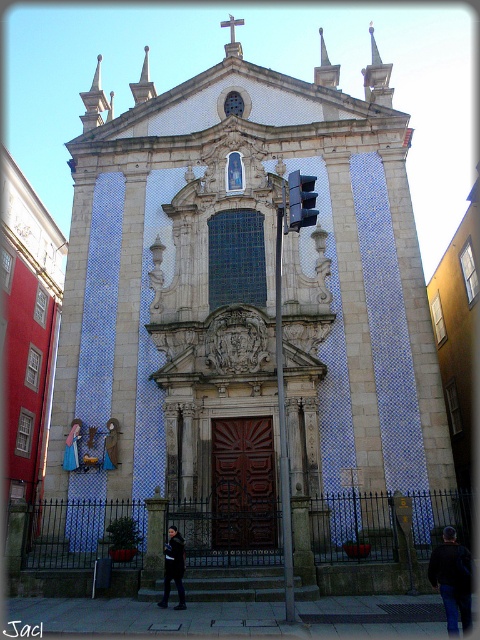
Based on the photo, is black fabric jacket at lower center smaller than dark brown leather jacket at center?

Incorrect, black fabric jacket at lower center is not smaller in size than dark brown leather jacket at center.

Is black fabric jacket at lower center below dark brown leather jacket at center?

No.

You are a GUI agent. You are given a task and a screenshot of the screen. Output one action in this format:
    pyautogui.click(x=<x>, y=<y>)
    Task: Click on the black fabric jacket at lower center
    This screenshot has width=480, height=640.
    Given the screenshot: What is the action you would take?
    pyautogui.click(x=452, y=580)

At what (x,y) coordinates should I click in order to perform the action: click on black fabric jacket at lower center. Please return your answer as a coordinate pair (x, y). Looking at the image, I should click on (452, 580).